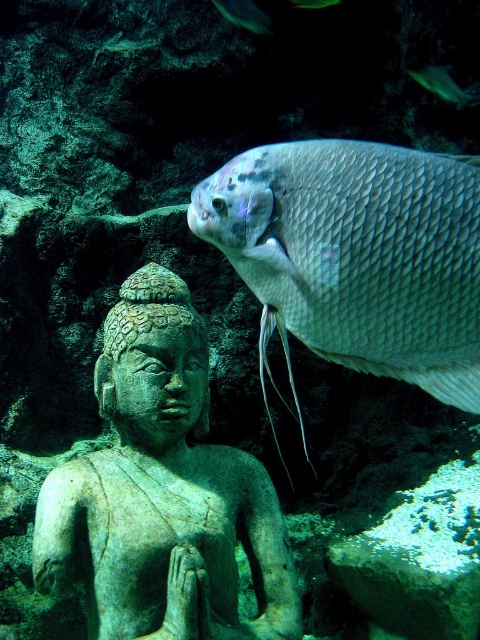
Question: Considering the relative positions of green stone statue at center and shiny silver fish at upper right in the image provided, where is green stone statue at center located with respect to shiny silver fish at upper right?

Choices:
 (A) right
 (B) left

Answer: (B)

Question: Is green stone statue at center wider than shiny silver fish at upper right?

Choices:
 (A) no
 (B) yes

Answer: (B)

Question: Is green stone statue at center bigger than shiny silver fish at upper right?

Choices:
 (A) no
 (B) yes

Answer: (B)

Question: Which point is farther to the camera?

Choices:
 (A) click(x=380, y=364)
 (B) click(x=164, y=515)

Answer: (B)